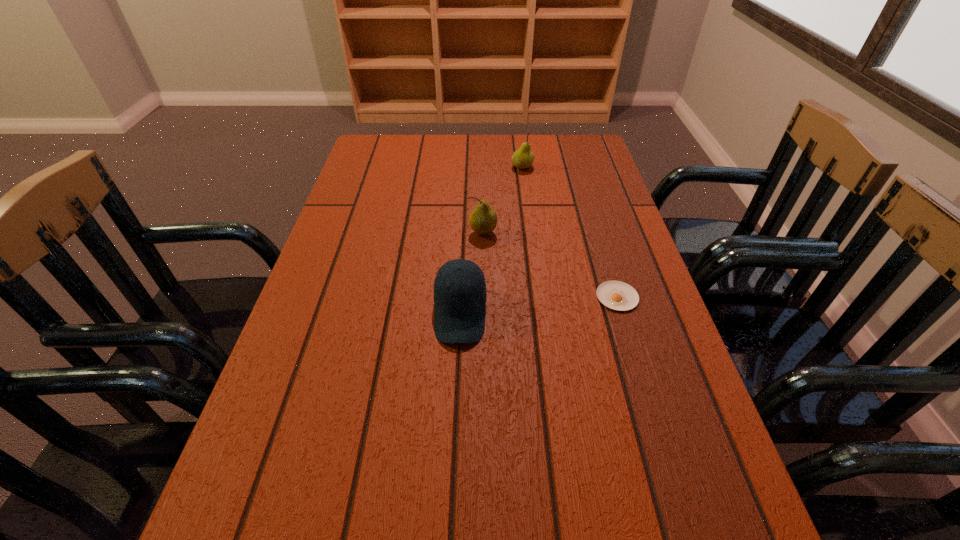
Where is `free space located on the front of the egg yolk`? Image resolution: width=960 pixels, height=540 pixels. free space located on the front of the egg yolk is located at coordinates (651, 408).

Image resolution: width=960 pixels, height=540 pixels. I want to click on object that is at the far edge, so [x=522, y=158].

I want to click on object at the right edge, so click(617, 295).

Identify the location of free space at the far edge of the desktop. (453, 162).

This screenshot has height=540, width=960. In the image, there is a desktop. Find the location of `free region at the left edge`. free region at the left edge is located at coordinates (280, 406).

Locate an element on the screen. free space at the right edge of the desktop is located at coordinates (565, 178).

Locate an element on the screen. blank space at the far right corner of the desktop is located at coordinates (583, 147).

Where is `vacant area that lies between the second object from right to left and the left pear`? This screenshot has width=960, height=540. vacant area that lies between the second object from right to left and the left pear is located at coordinates (502, 200).

Locate an element on the screen. free spot between the rightmost object and the baseball cap is located at coordinates (539, 305).

Where is `free area in between the third object from left to right and the baseball cap`? free area in between the third object from left to right and the baseball cap is located at coordinates (492, 240).